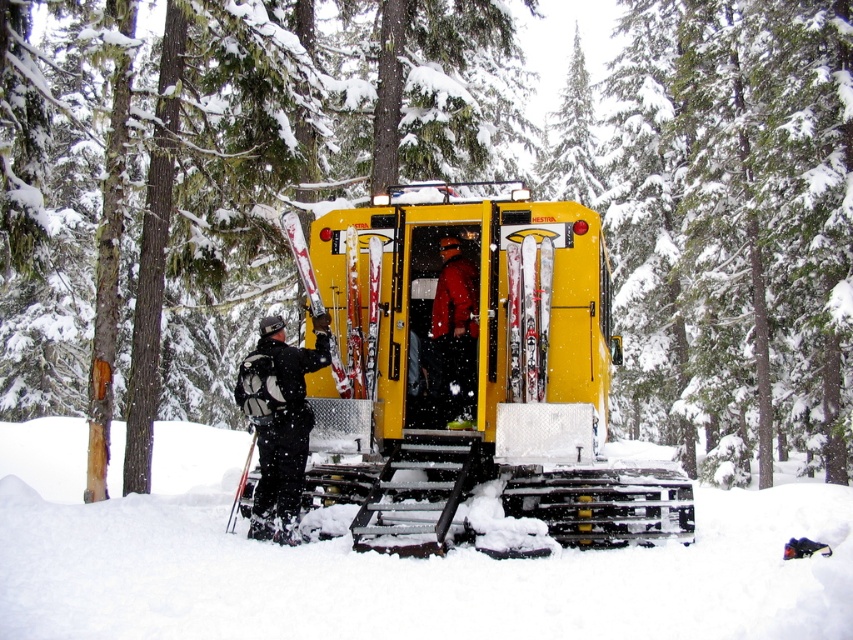
Question: Estimate the real-world distances between objects in this image. Which object is closer to the black matte snowboard at left?

Choices:
 (A) white fluffy snow at lower center
 (B) matte yellow bus at center
 (C) red matte jacket at center

Answer: (C)

Question: Can you confirm if white fluffy snow at lower center is wider than black matte snowboard at left?

Choices:
 (A) no
 (B) yes

Answer: (B)

Question: Can you confirm if black matte snowboard at left is smaller than red matte jacket at center?

Choices:
 (A) no
 (B) yes

Answer: (A)

Question: Can you confirm if white fluffy snow at lower center is positioned to the right of matte yellow bus at center?

Choices:
 (A) yes
 (B) no

Answer: (B)

Question: Based on their relative distances, which object is farther from the red matte jacket at center?

Choices:
 (A) white fluffy snow at lower center
 (B) black matte snowboard at left
 (C) matte yellow bus at center

Answer: (A)

Question: Which point appears closest to the camera in this image?

Choices:
 (A) (457, 244)
 (B) (426, 624)

Answer: (B)